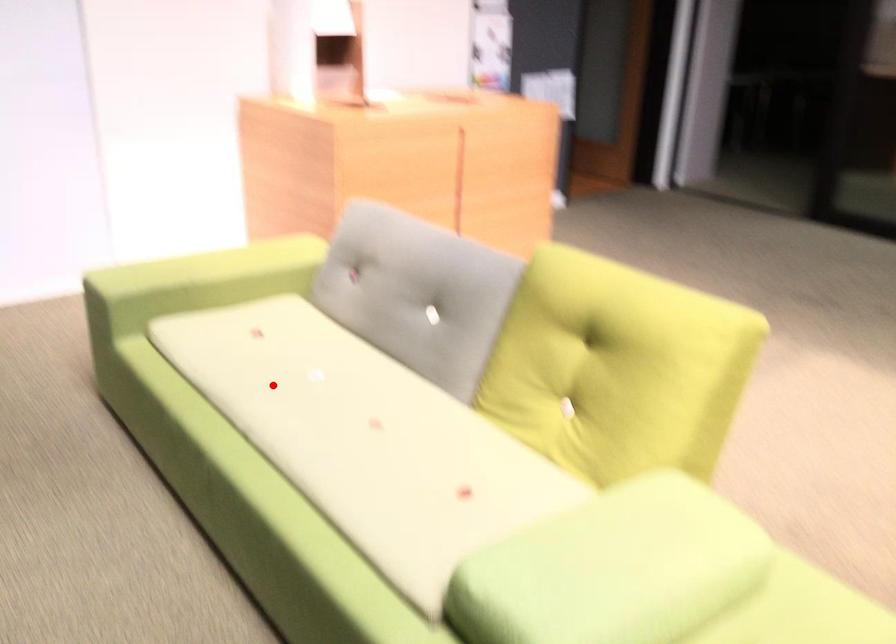
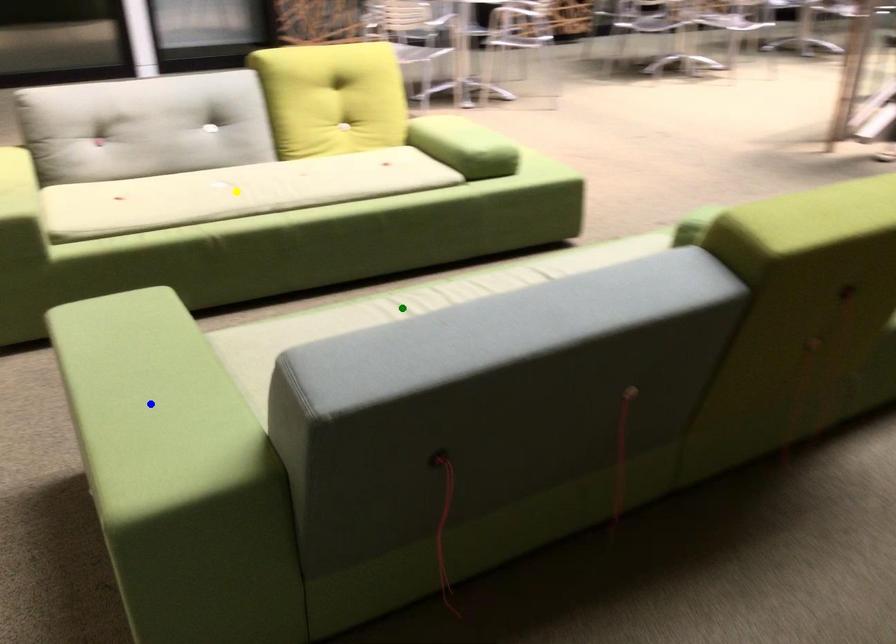
Question: I am providing you with two images of the same scene from different viewpoints. A red point is marked on the first image. You are given multiple points on the second image. Which point in image 2 represents the same 3d spot as the red point in image 1?

Choices:
 (A) yellow point
 (B) green point
 (C) blue point

Answer: (A)